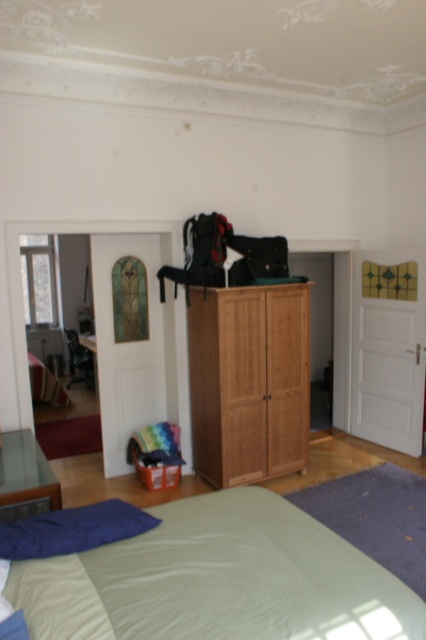
Which is more to the right, light green fabric bed at lower center or light brown wood wardrobe at center?

From the viewer's perspective, light brown wood wardrobe at center appears more on the right side.

How distant is light green fabric bed at lower center from light brown wood wardrobe at center?

light green fabric bed at lower center is 5.45 feet from light brown wood wardrobe at center.

Between point (40, 568) and point (210, 321), which one is positioned behind?

Positioned behind is point (210, 321).

You are a GUI agent. You are given a task and a screenshot of the screen. Output one action in this format:
    pyautogui.click(x=<x>, y=<y>)
    Task: Click on the light green fabric bed at lower center
    
    Given the screenshot: What is the action you would take?
    pyautogui.click(x=218, y=579)

Is light brown wood wardrobe at center further to camera compared to glass transparent dresser at lower left?

That is True.

From the picture: Between light brown wood wardrobe at center and glass transparent dresser at lower left, which one is positioned lower?

glass transparent dresser at lower left

The width and height of the screenshot is (426, 640). Find the location of `light brown wood wardrobe at center`. light brown wood wardrobe at center is located at coordinates (249, 381).

Which is behind, point (94, 618) or point (31, 436)?

The point (31, 436) is more distant.

Which is more to the right, light green fabric bed at lower center or glass transparent dresser at lower left?

Positioned to the right is light green fabric bed at lower center.

Between point (311, 630) and point (22, 461), which one is positioned in front?

Point (311, 630)

At what (x,y) coordinates should I click in order to perform the action: click on light green fabric bed at lower center. Please return your answer as a coordinate pair (x, y). Looking at the image, I should click on (218, 579).